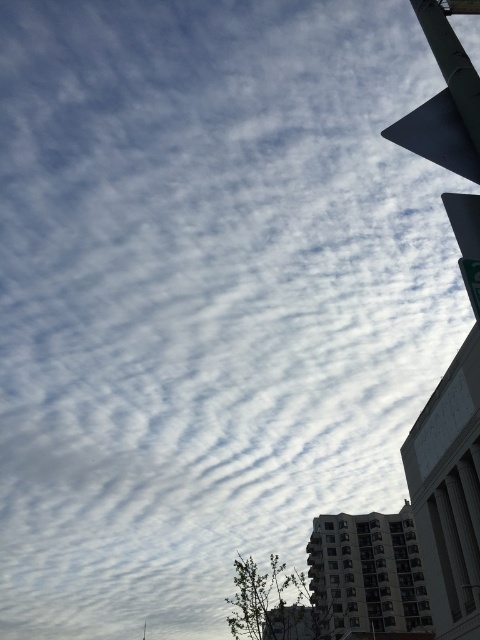
Question: Can you confirm if green matte traffic light at upper right is positioned to the right of green metallic pole at upper right?

Choices:
 (A) no
 (B) yes

Answer: (B)

Question: In this image, where is green matte traffic light at upper right located relative to green metallic pole at upper right?

Choices:
 (A) right
 (B) left

Answer: (A)

Question: Is green matte traffic light at upper right closer to camera compared to green metallic pole at upper right?

Choices:
 (A) yes
 (B) no

Answer: (B)